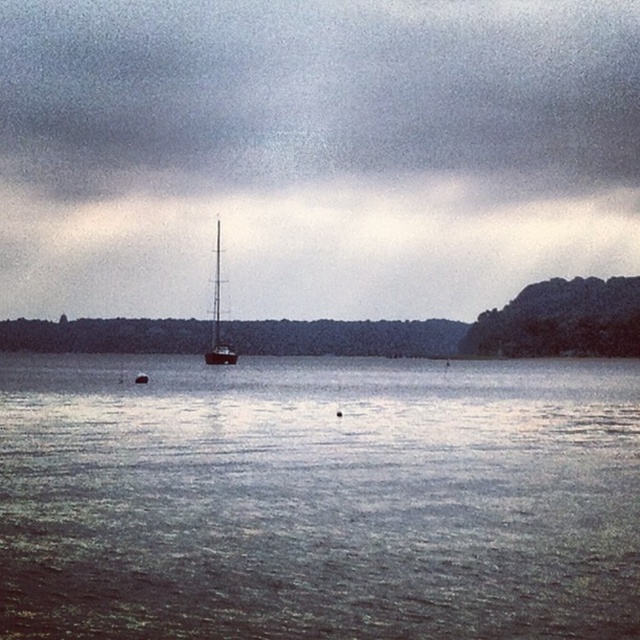
Question: Does gray reflective water at center appear under metallic silver mast at center?

Choices:
 (A) no
 (B) yes

Answer: (B)

Question: From the image, what is the correct spatial relationship of gray reflective water at center in relation to metallic silver mast at center?

Choices:
 (A) left
 (B) right

Answer: (B)

Question: Observing the image, what is the correct spatial positioning of gray reflective water at center in reference to metallic silver mast at center?

Choices:
 (A) right
 (B) left

Answer: (A)